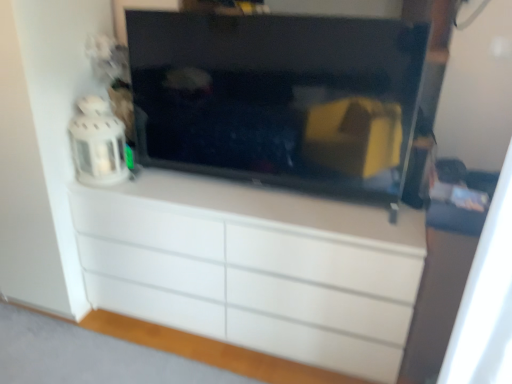
You are a GUI agent. You are given a task and a screenshot of the screen. Output one action in this format:
    pyautogui.click(x=<x>, y=<y>)
    Task: Click on the free space above white glossy chest of drawers at center (from a real-world perspective)
    This screenshot has height=384, width=512.
    Given the screenshot: What is the action you would take?
    pyautogui.click(x=246, y=198)